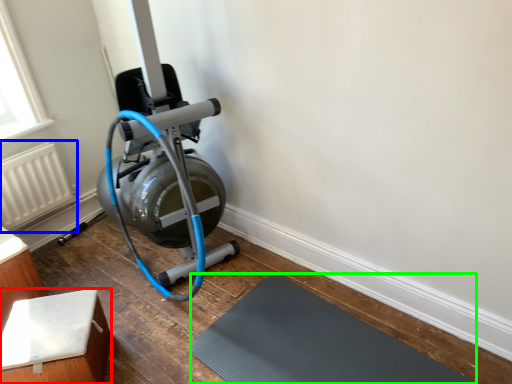
Question: Which is nearer to the furniture (highlighted by a red box)? radiator (highlighted by a blue box) or bath mat (highlighted by a green box).

Choices:
 (A) radiator
 (B) bath mat

Answer: (B)